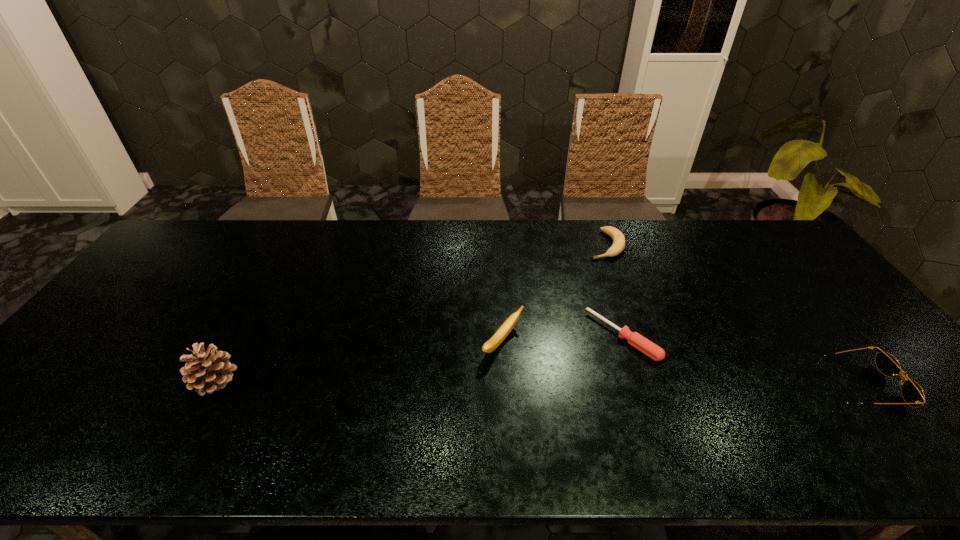
What are the coordinates of `the tallest object` in the screenshot? It's located at (206, 371).

Locate an element on the screen. The height and width of the screenshot is (540, 960). pinecone is located at coordinates (206, 371).

Identify the location of the rightmost object. (912, 393).

Identify the location of the third tallest object. (912, 393).

At what (x,y) coordinates should I click in order to perform the action: click on the farthest object. Please return your answer as a coordinate pair (x, y). Image resolution: width=960 pixels, height=540 pixels. Looking at the image, I should click on (618, 245).

Identify the location of the farther banana. (618, 245).

Where is `screwdriver`? Image resolution: width=960 pixels, height=540 pixels. screwdriver is located at coordinates click(x=636, y=340).

I want to click on the nearer banana, so click(x=489, y=346).

Locate an element on the screen. the second object from left to right is located at coordinates (489, 346).

Image resolution: width=960 pixels, height=540 pixels. I want to click on blank area located on the back of the leftmost object, so click(253, 309).